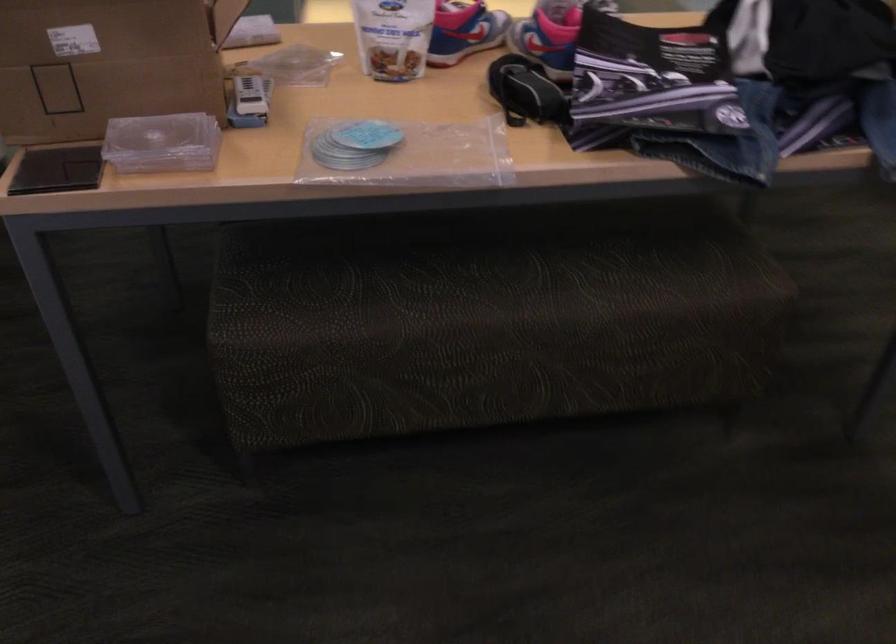
The height and width of the screenshot is (644, 896). Find the location of `sofa sitting surface`. sofa sitting surface is located at coordinates (496, 292).